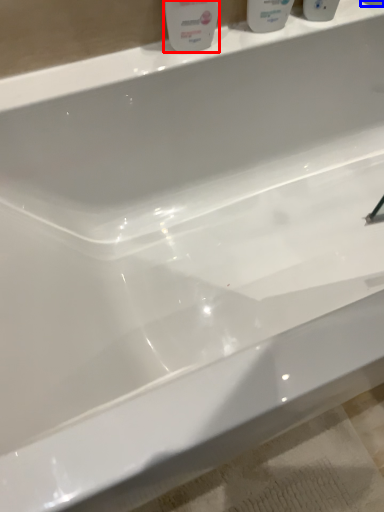
Question: Among these objects, which one is nearest to the camera, cleaning product (highlighted by a red box) or mouthwash (highlighted by a blue box)?

Choices:
 (A) cleaning product
 (B) mouthwash

Answer: (A)